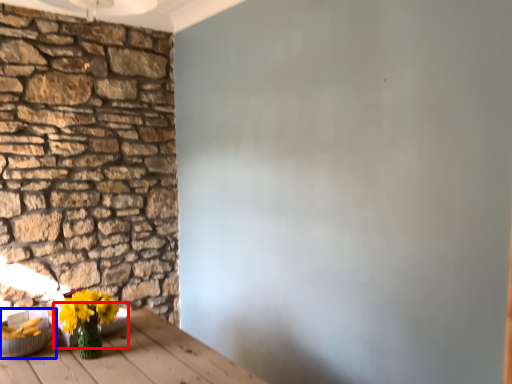
Question: Among these objects, which one is farthest to the camera, bowl (highlighted by a red box) or bowl (highlighted by a blue box)?

Choices:
 (A) bowl
 (B) bowl

Answer: (A)